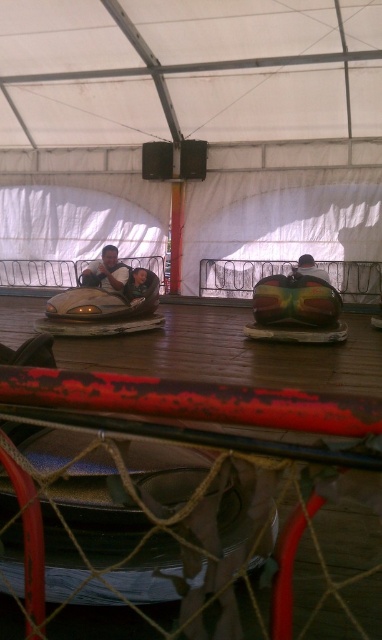
Does point (119, 264) come behind point (147, 272)?

Yes, it is behind point (147, 272).

Between matte black helmet at center and smooth plastic helmet at center, which one is positioned higher?

Positioned higher is matte black helmet at center.

The height and width of the screenshot is (640, 382). Describe the element at coordinates (106, 269) in the screenshot. I see `matte black helmet at center` at that location.

Identify the location of matte black helmet at center. The width and height of the screenshot is (382, 640). (106, 269).

Can you confirm if matte silver bumper car at center is positioned below smooth plastic helmet at center?

Indeed, matte silver bumper car at center is positioned under smooth plastic helmet at center.

Does point (121, 332) come closer to viewer compared to point (145, 269)?

Yes, point (121, 332) is in front of point (145, 269).

What do you see at coordinates (101, 310) in the screenshot? I see `matte silver bumper car at center` at bounding box center [101, 310].

Where is `matte silver bumper car at center`? matte silver bumper car at center is located at coordinates (101, 310).

Is point (82, 336) farther from camera compared to point (84, 276)?

That is False.

Does matte silver bumper car at center appear under matte black helmet at center?

Yes.

Who is more forward, (110, 294) or (123, 282)?

Point (110, 294) is more forward.

The height and width of the screenshot is (640, 382). I want to click on matte silver bumper car at center, so click(101, 310).